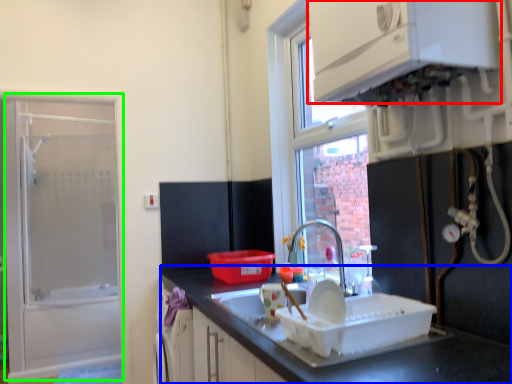
Question: Which object is positioned closest to cabinetry (highlighted by a red box)? Select from countertop (highlighted by a blue box) and screen door (highlighted by a green box).

Choices:
 (A) countertop
 (B) screen door

Answer: (A)